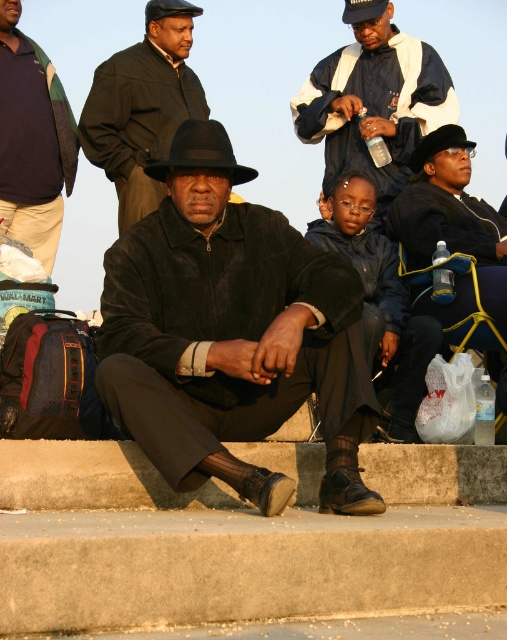
You are a photographer trying to capture a photo of both the black felt hat at upper right and the dark blue leather cap at upper center. Which hat should you focus on first if you want to include both in your frame without moving the camera?

The black felt hat at upper right is positioned on the right side of dark blue leather cap at upper center, so you should focus on the dark blue leather cap at upper center first to ensure both are in the frame.

Based on the photo, you are a photographer trying to capture both the black felt hat at upper right and the dark blue leather cap at upper center in a single frame. Given their sizes, which hat should you focus on to ensure both are visible without cropping?

The black felt hat at upper right is bigger than the dark blue leather cap at upper center. To ensure both are visible without cropping, focus on the black felt hat at upper right since it is larger and will occupy more space in the frame, allowing the smaller dark blue leather cap at upper center to fit alongside.

You are standing in the scene and want to move from point A to point B. Point A is located at coordinates point [413,120] and point B is at point [227,164]. Which direction should you move to go from point A to point B?

To move from point A to point B, you should move downward and to the right since point B is lower and further to the right on the coordinate plane compared to point A.